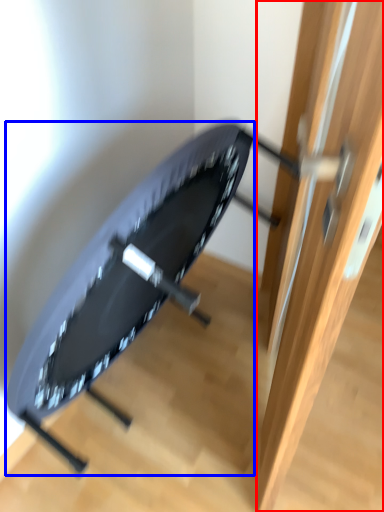
Question: Among these objects, which one is nearest to the camera, door (highlighted by a red box) or swivel chair (highlighted by a blue box)?

Choices:
 (A) door
 (B) swivel chair

Answer: (A)